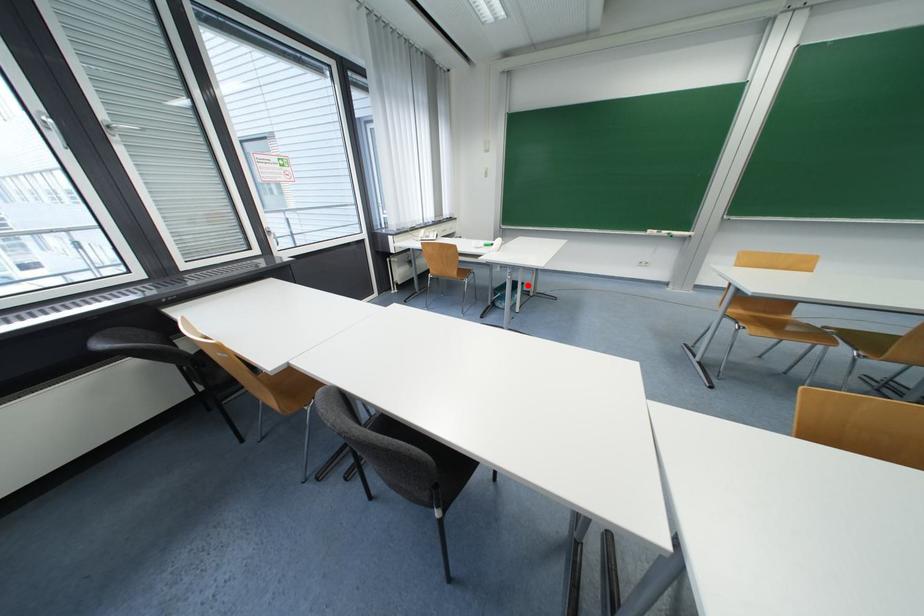
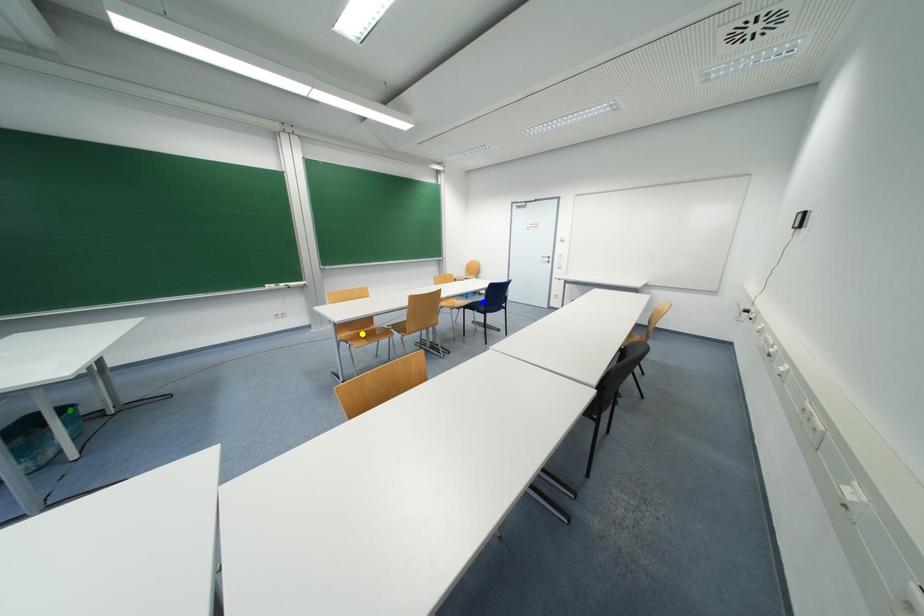
Question: I am providing you with two images of the same scene from different viewpoints. A red point is marked on the first image. You are given multiple points on the second image. Which spot in image 2 lines up with the point in image 1?

Choices:
 (A) blue point
 (B) green point
 (C) yellow point

Answer: (B)